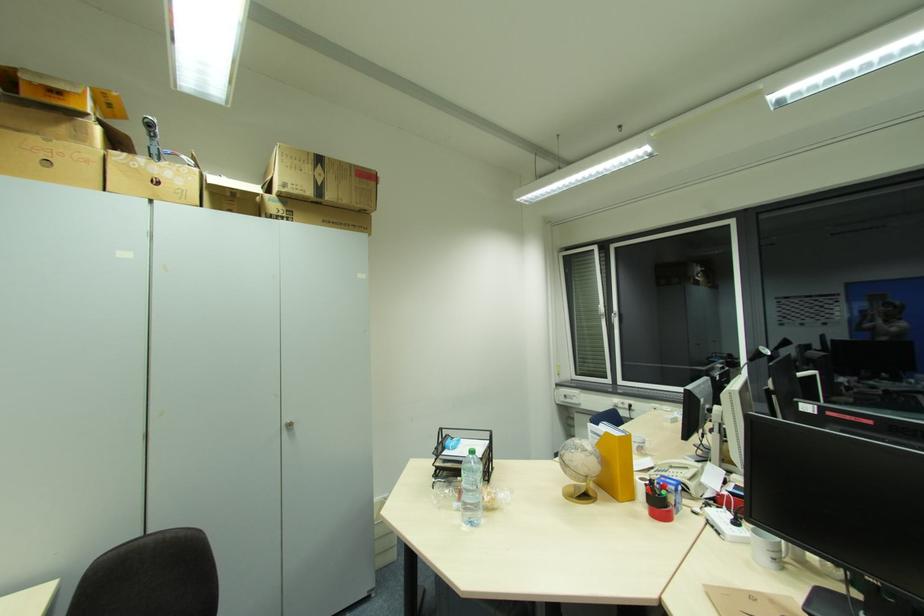
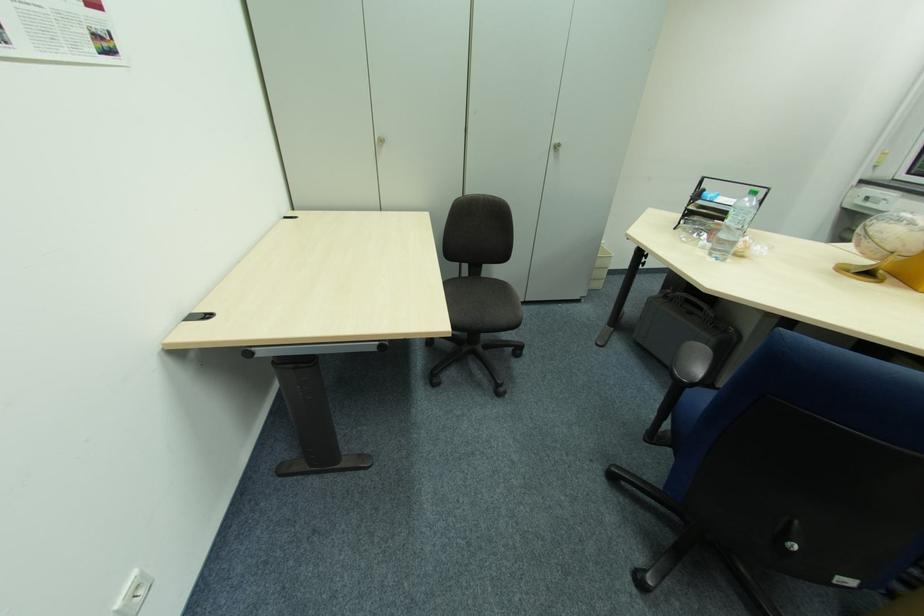
Find the pixel in the second image that matches (286,430) in the first image.

(554, 150)